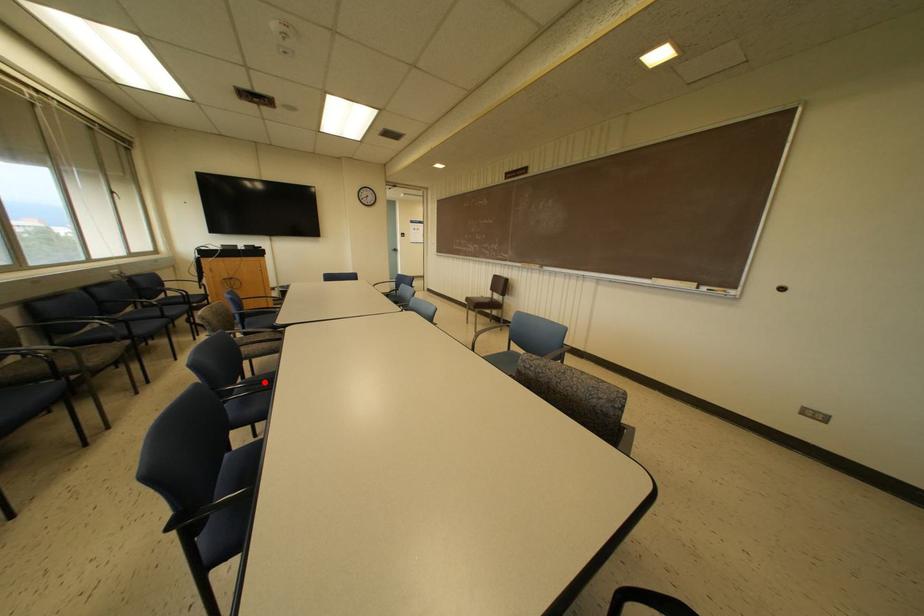
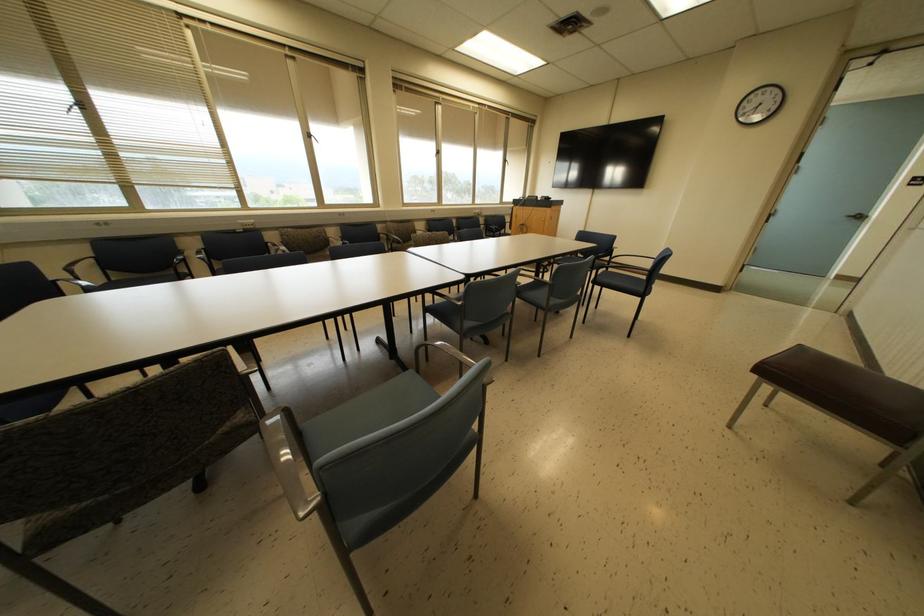
Question: I am providing you with two images of the same scene from different viewpoints. A red point is marked on the first image. Can you still see the location of the red point in image 2?

Choices:
 (A) Yes
 (B) No

Answer: (B)